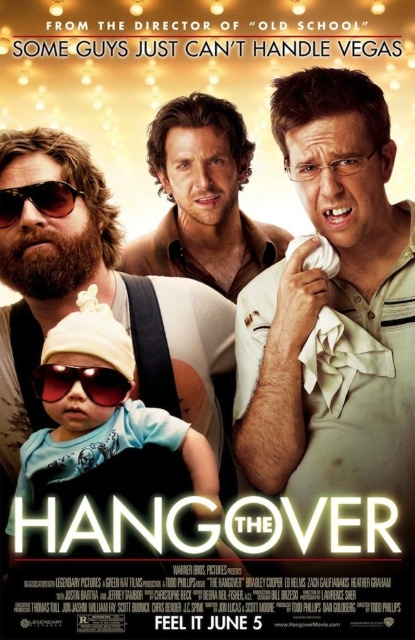
Question: Which point is closer to the camera?

Choices:
 (A) white striped polo shirt at center
 (B) sunglassesmatte/black at left
 (C) translucent plastic goggles at center
 (D) matte brown shirt at center

Answer: (C)

Question: Which object is closer to the camera taking this photo?

Choices:
 (A) translucent plastic goggles at center
 (B) white striped polo shirt at center
 (C) matte brown shirt at center
 (D) sunglassesmatte/black at left

Answer: (A)

Question: Does white striped polo shirt at center appear over sunglassesmatte/black at left?

Choices:
 (A) no
 (B) yes

Answer: (A)

Question: Is white striped polo shirt at center closer to camera compared to matte brown shirt at center?

Choices:
 (A) yes
 (B) no

Answer: (A)

Question: Observing the image, what is the correct spatial positioning of translucent plastic goggles at center in reference to sunglassesmatte/black at left?

Choices:
 (A) left
 (B) right

Answer: (B)

Question: Considering the real-world distances, which object is closest to the white striped polo shirt at center?

Choices:
 (A) matte brown shirt at center
 (B) translucent plastic goggles at center

Answer: (B)